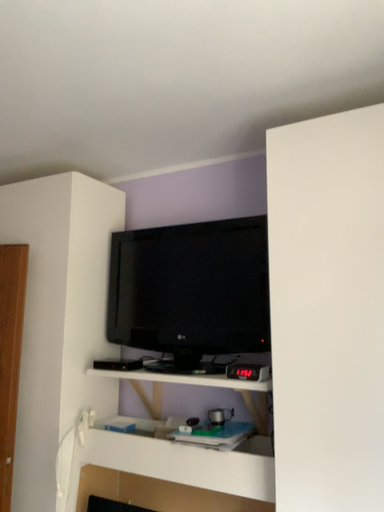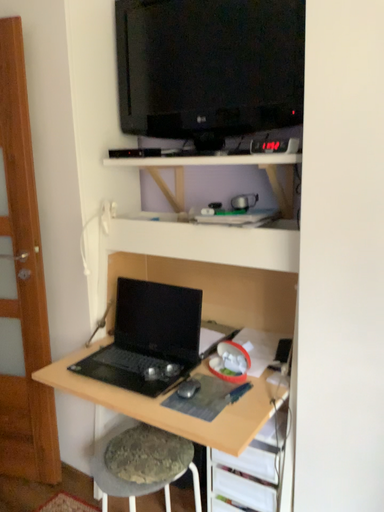
Question: How did the camera likely rotate when shooting the video?

Choices:
 (A) rotated upward
 (B) rotated downward

Answer: (B)